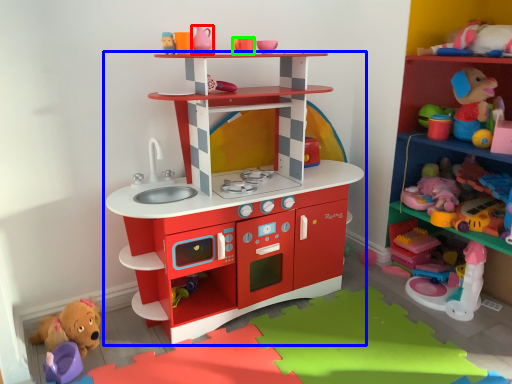
Question: Based on their relative distances, which object is farther from toy (highlighted by a red box)? Choose from shelf (highlighted by a blue box) and toy (highlighted by a green box).

Choices:
 (A) shelf
 (B) toy

Answer: (A)